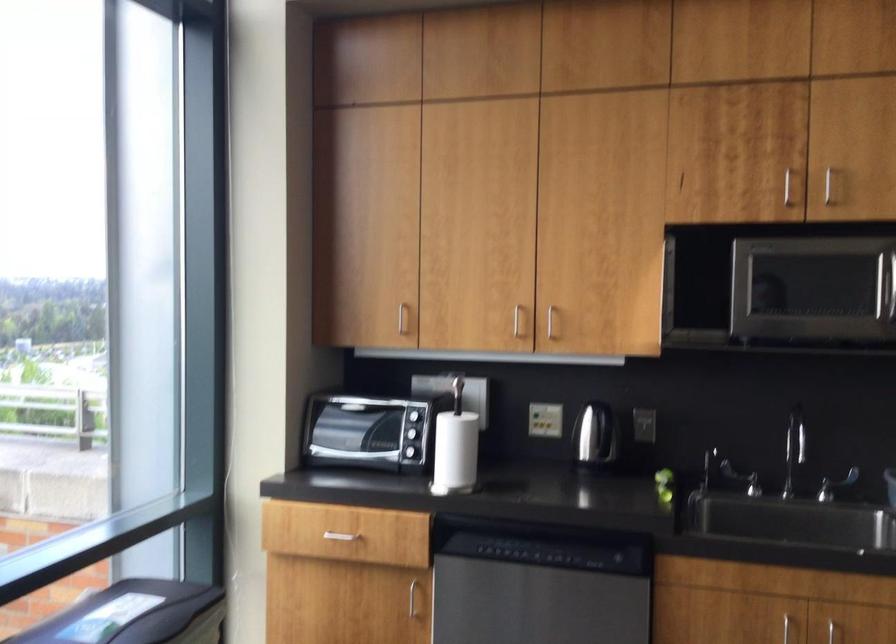
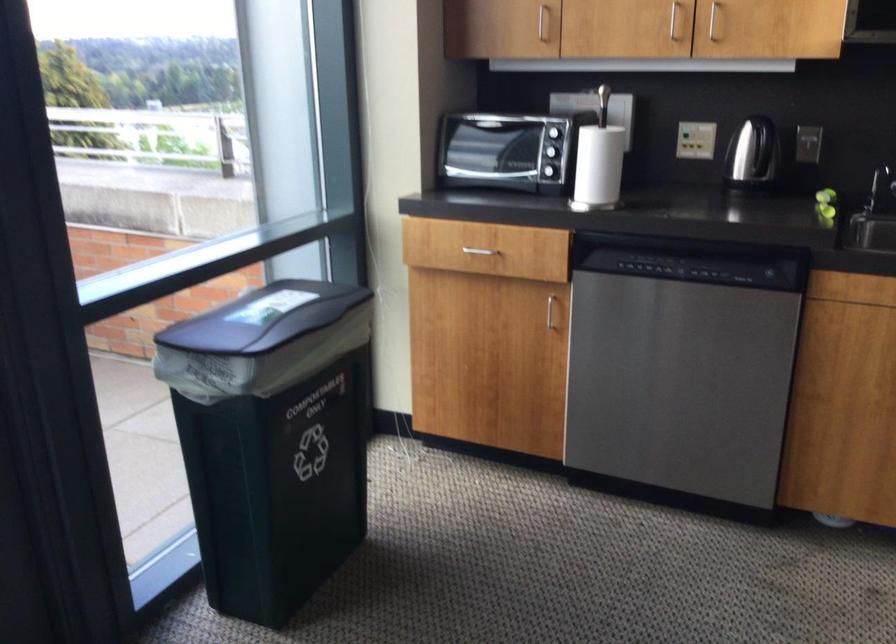
Find the pixel in the second image that matches point 711,476 in the first image.

(879, 187)